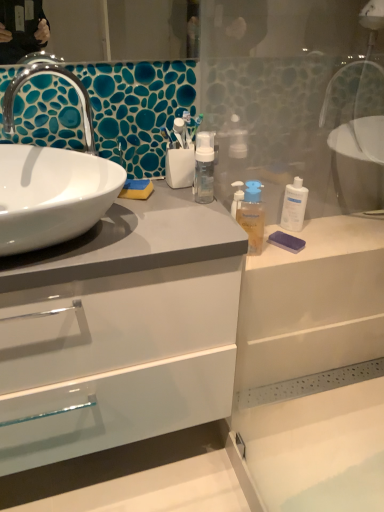
Find the location of a particular element. free spot above white glossy cabinet at left (from a real-world perspective) is located at coordinates (130, 211).